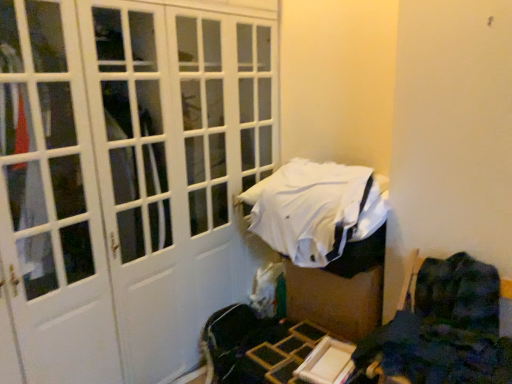
Question: Is dark blue fabric chair at lower right with white matte door at center?

Choices:
 (A) no
 (B) yes

Answer: (A)

Question: Considering the relative positions of dark blue fabric chair at lower right and white matte door at center in the image provided, is dark blue fabric chair at lower right to the right of white matte door at center from the viewer's perspective?

Choices:
 (A) yes
 (B) no

Answer: (A)

Question: From a real-world perspective, does dark blue fabric chair at lower right sit lower than white matte door at center?

Choices:
 (A) no
 (B) yes

Answer: (B)

Question: Is dark blue fabric chair at lower right far away from white matte door at center?

Choices:
 (A) no
 (B) yes

Answer: (B)

Question: Does dark blue fabric chair at lower right have a lesser height compared to white matte door at center?

Choices:
 (A) yes
 (B) no

Answer: (A)

Question: Considering the relative sizes of dark blue fabric chair at lower right and white matte door at center in the image provided, is dark blue fabric chair at lower right bigger than white matte door at center?

Choices:
 (A) no
 (B) yes

Answer: (A)

Question: Can you confirm if white fabric bed at center is thinner than white matte door at center?

Choices:
 (A) yes
 (B) no

Answer: (A)

Question: Are white fabric bed at center and white matte door at center far apart?

Choices:
 (A) yes
 (B) no

Answer: (B)

Question: From the image's perspective, does white fabric bed at center appear higher than white matte door at center?

Choices:
 (A) no
 (B) yes

Answer: (A)

Question: Is white fabric bed at center outside white matte door at center?

Choices:
 (A) no
 (B) yes

Answer: (B)

Question: Can you see white fabric bed at center touching white matte door at center?

Choices:
 (A) yes
 (B) no

Answer: (B)

Question: Is the position of white fabric bed at center less distant than that of white matte door at center?

Choices:
 (A) yes
 (B) no

Answer: (B)

Question: Can you confirm if white fabric bed at center is positioned to the right of dark blue fabric chair at lower right?

Choices:
 (A) yes
 (B) no

Answer: (B)